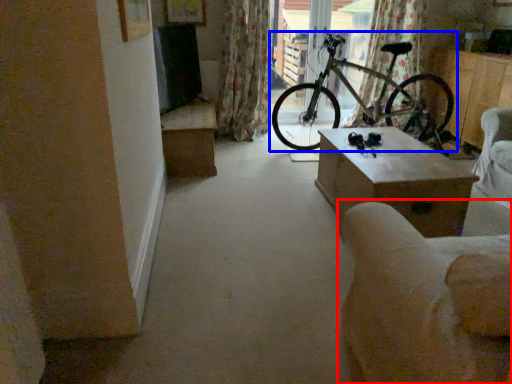
Question: Which point is closer to the camera, armchair (highlighted by a red box) or bicycle (highlighted by a blue box)?

Choices:
 (A) armchair
 (B) bicycle

Answer: (A)